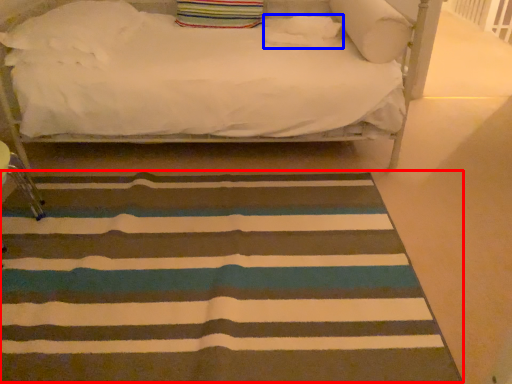
Question: Which of the following is the farthest to the observer, mat (highlighted by a red box) or pillow (highlighted by a blue box)?

Choices:
 (A) mat
 (B) pillow

Answer: (B)